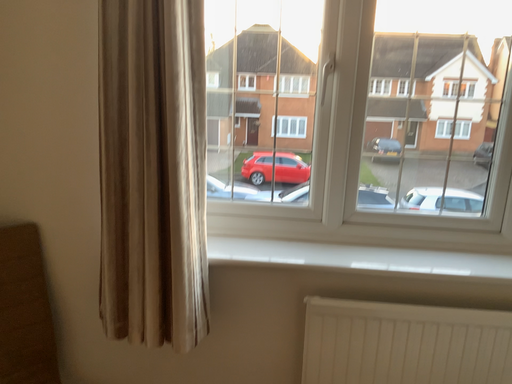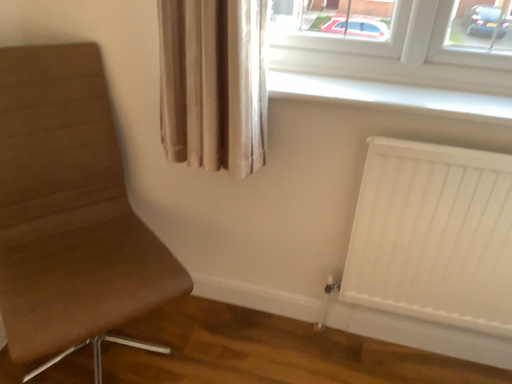
Question: Which way did the camera rotate in the video?

Choices:
 (A) rotated upward
 (B) rotated downward

Answer: (B)